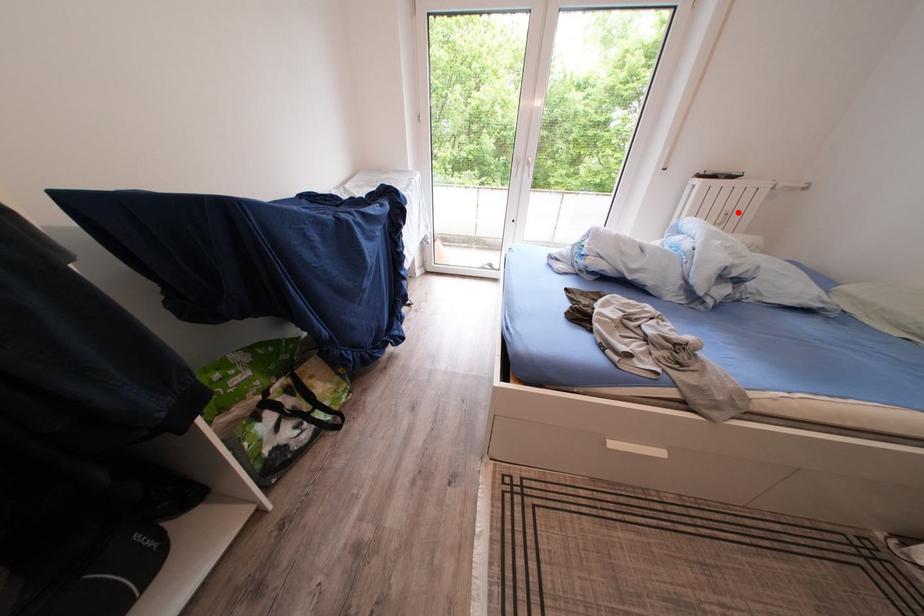
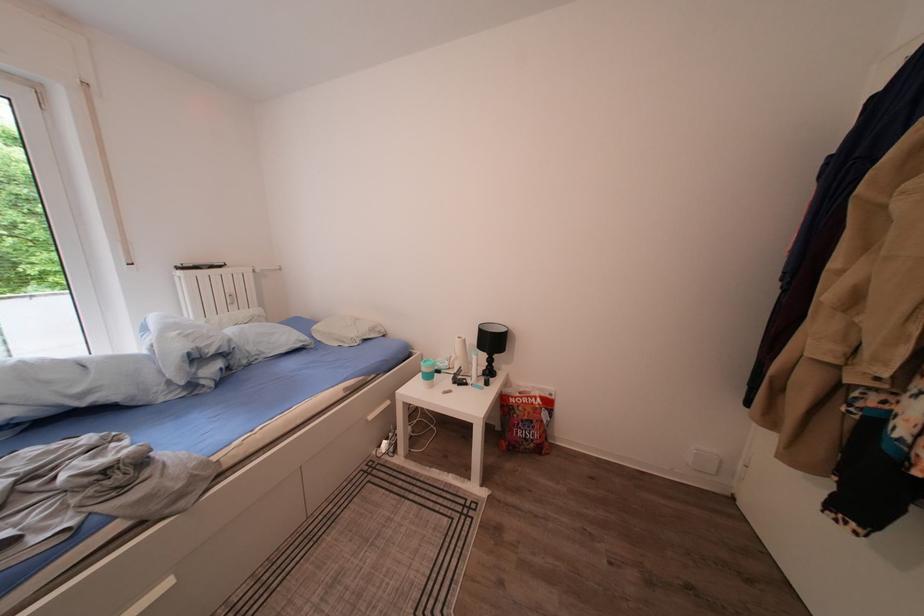
Find the pixel in the second image that matches the highlighted location in the first image.

(238, 296)